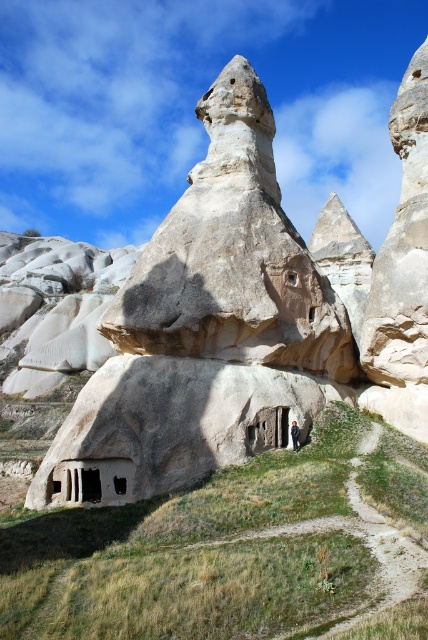
Does beige stone rock formation at center have a lesser width compared to smooth beige rock formation at center?

Indeed, beige stone rock formation at center has a lesser width compared to smooth beige rock formation at center.

Can you confirm if beige stone rock formation at center is smaller than smooth beige rock formation at center?

Incorrect, beige stone rock formation at center is not smaller in size than smooth beige rock formation at center.

In order to click on beige stone rock formation at center in this screenshot , I will do `click(205, 328)`.

At what (x,y) coordinates should I click in order to perform the action: click on beige stone rock formation at center. Please return your answer as a coordinate pair (x, y). This screenshot has height=640, width=428. Looking at the image, I should click on (205, 328).

Where is `smooth beige rock formation at center`? smooth beige rock formation at center is located at coordinates (214, 547).

Describe the element at coordinates (214, 547) in the screenshot. This screenshot has height=640, width=428. I see `smooth beige rock formation at center` at that location.

Where is `smooth beige rock formation at center`? smooth beige rock formation at center is located at coordinates (214, 547).

Based on the photo, is beige stone rock formation at center below light brown leather jacket at center?

No, beige stone rock formation at center is not below light brown leather jacket at center.

Does point (309, 387) come farther from viewer compared to point (296, 438)?

Yes, it is behind point (296, 438).

Is point (86, 492) positioned in front of point (297, 445)?

Yes, it is in front of point (297, 445).

At what (x,y) coordinates should I click in order to perform the action: click on beige stone rock formation at center. Please return your answer as a coordinate pair (x, y). The width and height of the screenshot is (428, 640). Looking at the image, I should click on (205, 328).